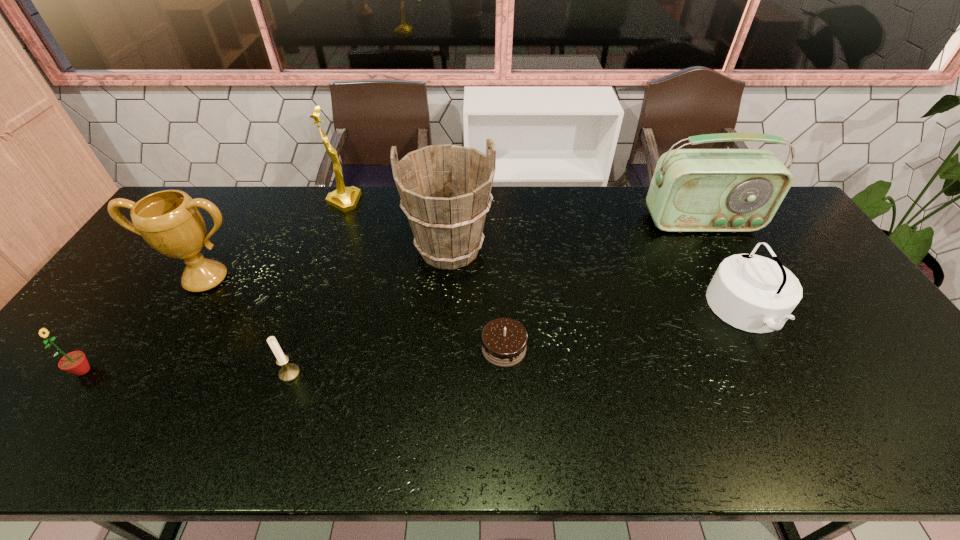
Find the location of a particular element. The image size is (960, 540). bucket is located at coordinates (445, 190).

This screenshot has width=960, height=540. What are the coordinates of `the right award` in the screenshot? It's located at (345, 199).

The image size is (960, 540). In order to click on the farther award in this screenshot , I will do `click(345, 199)`.

Locate an element on the screen. The width and height of the screenshot is (960, 540). radio receiver is located at coordinates (692, 190).

Locate an element on the screen. the nearer award is located at coordinates (169, 221).

Locate an element on the screen. the seventh object from right to left is located at coordinates (169, 221).

Where is `kettle`? kettle is located at coordinates (753, 293).

Locate an element on the screen. the leftmost object is located at coordinates (75, 362).

You are a GUI agent. You are given a task and a screenshot of the screen. Output one action in this format:
    pyautogui.click(x=<x>, y=<y>)
    Task: Click on the candle holder
    The image size is (960, 540).
    Given the screenshot: What is the action you would take?
    288,372

Identify the location of the shortest object. (504, 340).